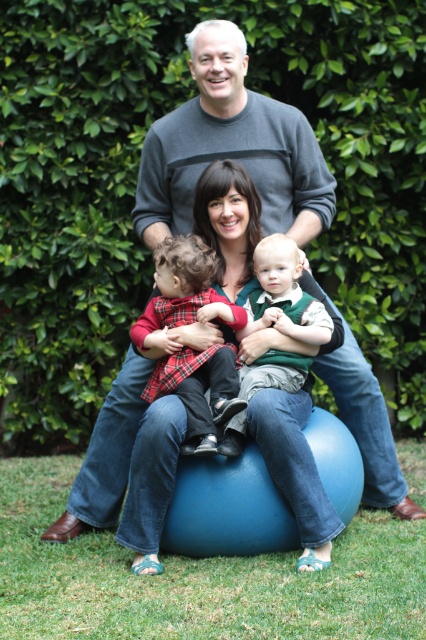
Does gray sweater at center appear on the left side of green velvety vest at center?

Yes, gray sweater at center is to the left of green velvety vest at center.

Consider the image. Between gray sweater at center and green velvety vest at center, which one appears on the left side from the viewer's perspective?

gray sweater at center

Which is in front, point (178, 157) or point (244, 428)?

Positioned in front is point (244, 428).

At what (x,y) coordinates should I click in order to perform the action: click on gray sweater at center. Please return your answer as a coordinate pair (x, y). The height and width of the screenshot is (640, 426). Looking at the image, I should click on click(232, 148).

Does plaid fabric baby at center have a lesser width compared to green velvety vest at center?

Incorrect, plaid fabric baby at center's width is not less than green velvety vest at center's.

Is point (227, 372) positioned in front of point (308, 301)?

Yes, point (227, 372) is closer to viewer.

Which is in front, point (192, 320) or point (307, 362)?

Point (307, 362)

Locate an element on the screen. This screenshot has width=426, height=640. plaid fabric baby at center is located at coordinates (189, 348).

Can you confirm if gray sweater at center is positioned above plaid fabric baby at center?

Correct, gray sweater at center is located above plaid fabric baby at center.

Between gray sweater at center and plaid fabric baby at center, which one appears on the left side from the viewer's perspective?

From the viewer's perspective, plaid fabric baby at center appears more on the left side.

The height and width of the screenshot is (640, 426). Identify the location of gray sweater at center. click(x=232, y=148).